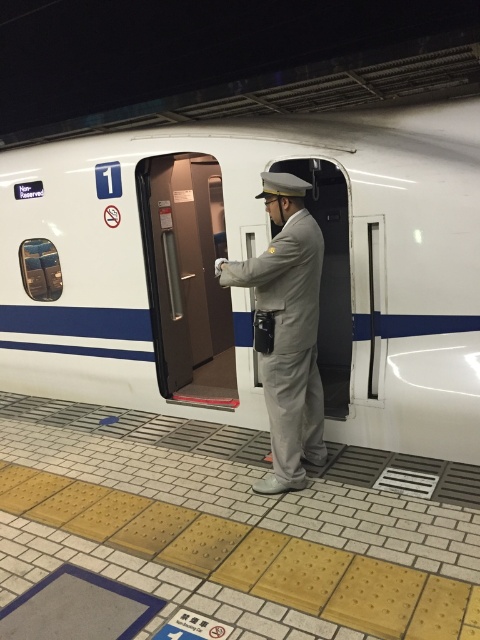
Which is more to the left, white glossy train at center or gray uniform at center?

Positioned to the left is white glossy train at center.

Does white glossy train at center have a smaller size compared to gray uniform at center?

A: Actually, white glossy train at center might be larger than gray uniform at center.

Between point (106, 164) and point (296, 417), which one is positioned in front?

Point (296, 417) is in front.

In order to click on white glossy train at center in this screenshot , I will do `click(249, 257)`.

Can you confirm if brown matte door at center is thinner than gray uniform at center?

In fact, brown matte door at center might be wider than gray uniform at center.

Who is positioned more to the right, brown matte door at center or gray uniform at center?

gray uniform at center is more to the right.

You are a GUI agent. You are given a task and a screenshot of the screen. Output one action in this format:
    pyautogui.click(x=<x>, y=<y>)
    Task: Click on the brown matte door at center
    The height and width of the screenshot is (640, 480).
    Given the screenshot: What is the action you would take?
    pyautogui.click(x=187, y=276)

Is white glossy train at center to the right of brown matte door at center from the viewer's perspective?

Indeed, white glossy train at center is positioned on the right side of brown matte door at center.

Locate an element on the screen. white glossy train at center is located at coordinates (249, 257).